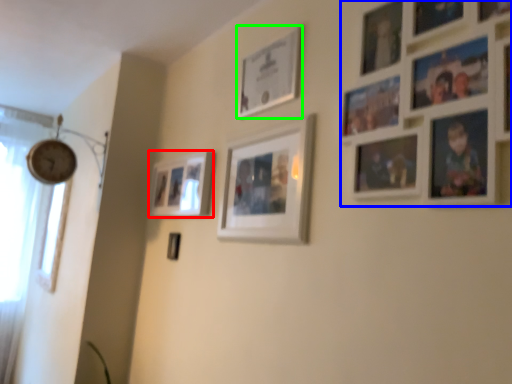
Question: Estimate the real-world distances between objects in this image. Which object is farther from picture frame (highlighted by a red box), picture frame (highlighted by a blue box) or picture frame (highlighted by a green box)?

Choices:
 (A) picture frame
 (B) picture frame

Answer: (A)